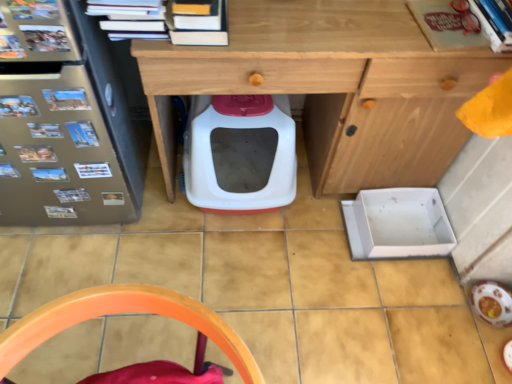
Question: Is hardcover books at upper center, the third book when ordered from right to left, located outside orange plastic chair at lower center?

Choices:
 (A) no
 (B) yes

Answer: (B)

Question: From the image's perspective, would you say hardcover books at upper center, the third book when ordered from right to left, is shown under orange plastic chair at lower center?

Choices:
 (A) yes
 (B) no

Answer: (B)

Question: Does hardcover books at upper center, the third book when ordered from right to left, turn towards orange plastic chair at lower center?

Choices:
 (A) no
 (B) yes

Answer: (A)

Question: Can you confirm if hardcover books at upper center, the third book when ordered from right to left, is wider than orange plastic chair at lower center?

Choices:
 (A) no
 (B) yes

Answer: (A)

Question: From a real-world perspective, does hardcover books at upper center, the third book when ordered from right to left, stand above orange plastic chair at lower center?

Choices:
 (A) no
 (B) yes

Answer: (B)

Question: Considering the relative positions of hardcover books at upper center, the third book when ordered from right to left, and orange plastic chair at lower center in the image provided, is hardcover books at upper center, the third book when ordered from right to left, to the right of orange plastic chair at lower center from the viewer's perspective?

Choices:
 (A) yes
 (B) no

Answer: (A)

Question: Is matte red book at upper right, which appears as the 2th book when viewed from the left, at the right side of hardcover book at upper right, the 1th book viewed from the right?

Choices:
 (A) yes
 (B) no

Answer: (B)

Question: From a real-world perspective, is matte red book at upper right, which appears as the 2th book when viewed from the left, beneath hardcover book at upper right, the 1th book viewed from the right?

Choices:
 (A) no
 (B) yes

Answer: (B)

Question: Does matte red book at upper right, which is the 2th book from right to left, lie behind hardcover book at upper right, the 1th book viewed from the right?

Choices:
 (A) yes
 (B) no

Answer: (A)

Question: Is hardcover book at upper right, the 1th book viewed from the right, at the back of matte red book at upper right, which appears as the 2th book when viewed from the left?

Choices:
 (A) yes
 (B) no

Answer: (B)

Question: Is matte red book at upper right, which is the 2th book from right to left, thinner than hardcover book at upper right, which is the 3th book from left to right?

Choices:
 (A) no
 (B) yes

Answer: (B)

Question: Considering the relative positions of matte red book at upper right, which appears as the 2th book when viewed from the left, and hardcover book at upper right, which is the 3th book from left to right, in the image provided, is matte red book at upper right, which appears as the 2th book when viewed from the left, in front of hardcover book at upper right, which is the 3th book from left to right,?

Choices:
 (A) no
 (B) yes

Answer: (A)

Question: Considering the relative sizes of matte red book at upper right, which is the 2th book from right to left, and wooden desk at center in the image provided, is matte red book at upper right, which is the 2th book from right to left, thinner than wooden desk at center?

Choices:
 (A) no
 (B) yes

Answer: (B)